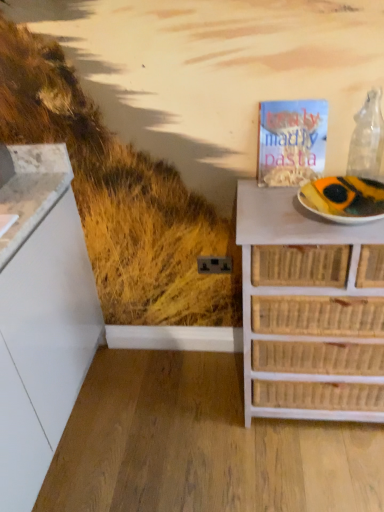
Question: In terms of width, does white wicker chest of drawers at right look wider or thinner when compared to transparent glass wine bottle at upper right?

Choices:
 (A) wide
 (B) thin

Answer: (A)

Question: Is white wicker chest of drawers at right taller or shorter than transparent glass wine bottle at upper right?

Choices:
 (A) short
 (B) tall

Answer: (B)

Question: Estimate the real-world distances between objects in this image. Which object is farther from the transparent glass wine bottle at upper right?

Choices:
 (A) white paper plate at right
 (B) matte paper magazine at upper right
 (C) white wicker chest of drawers at right

Answer: (C)

Question: Estimate the real-world distances between objects in this image. Which object is closer to the white wicker chest of drawers at right?

Choices:
 (A) transparent glass wine bottle at upper right
 (B) white paper plate at right
 (C) matte paper magazine at upper right

Answer: (B)